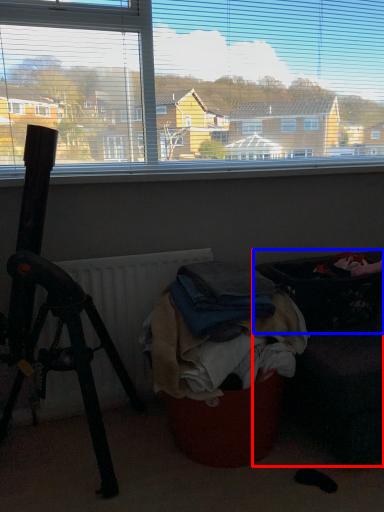
Question: Which object is closer to the camera taking this photo, furniture (highlighted by a red box) or laundry basket (highlighted by a blue box)?

Choices:
 (A) furniture
 (B) laundry basket

Answer: (A)